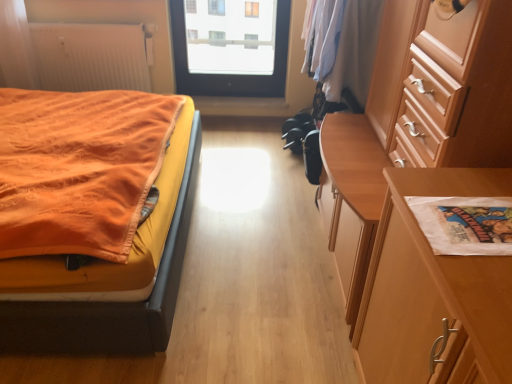
This screenshot has width=512, height=384. I want to click on free spot above white paper at right (from a real-world perspective), so click(x=477, y=232).